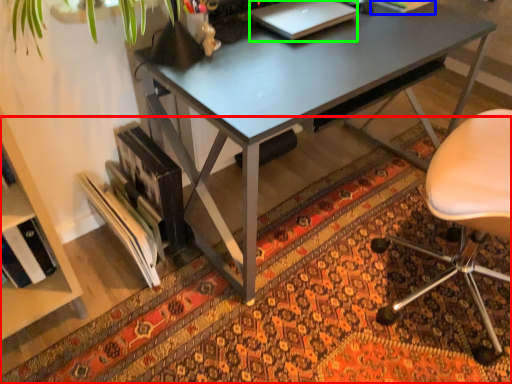
Question: Estimate the real-world distances between objects in this image. Which object is farther from mat (highlighted by a red box), book (highlighted by a blue box) or laptop (highlighted by a green box)?

Choices:
 (A) book
 (B) laptop

Answer: (A)